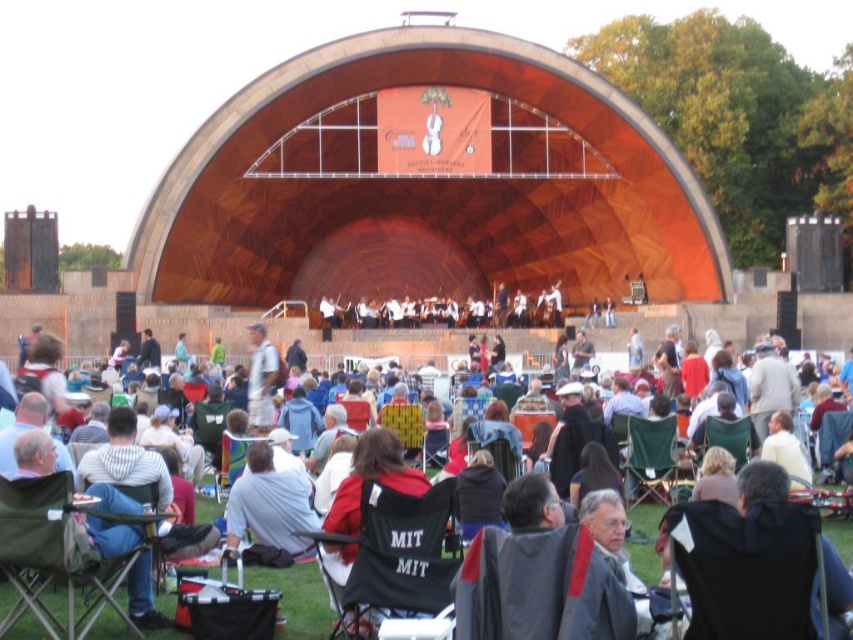
Question: Which object is positioned closest to the light gray fabric jacket at center?

Choices:
 (A) black fabric chairs at center
 (B) green fabric chair at lower center

Answer: (A)

Question: Can you confirm if black fabric chair at center is thinner than black fabric chairs at center?

Choices:
 (A) yes
 (B) no

Answer: (A)

Question: Can you confirm if wooden amphitheater at center is positioned above green fabric chair at lower center?

Choices:
 (A) yes
 (B) no

Answer: (A)

Question: Is black fabric chairs at center thinner than light gray fabric jacket at center?

Choices:
 (A) yes
 (B) no

Answer: (B)

Question: Which of the following is the farthest from the observer?

Choices:
 (A) light gray fabric jacket at center
 (B) green fabric chair at lower left
 (C) green fabric chair at lower center

Answer: (A)

Question: Among these points, which one is farthest from the camera?

Choices:
 (A) (242, 196)
 (B) (257, 362)

Answer: (A)